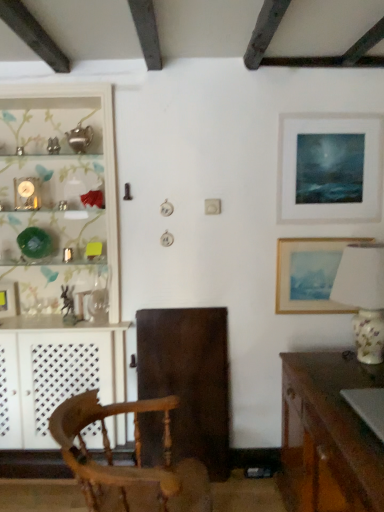
Question: Can you confirm if metallic rectangular frame at left, the first picture frame in the left-to-right sequence, is wider than wooden desk at lower right?

Choices:
 (A) yes
 (B) no

Answer: (B)

Question: Is metallic rectangular frame at left, positioned as the third picture frame in top-to-bottom order, taller than wooden desk at lower right?

Choices:
 (A) yes
 (B) no

Answer: (B)

Question: Is metallic rectangular frame at left, positioned as the third picture frame in top-to-bottom order, positioned behind wooden desk at lower right?

Choices:
 (A) yes
 (B) no

Answer: (A)

Question: Is metallic rectangular frame at left, the first picture frame in the bottom-to-top sequence, located outside wooden desk at lower right?

Choices:
 (A) no
 (B) yes

Answer: (B)

Question: Is metallic rectangular frame at left, the first picture frame in the bottom-to-top sequence, facing towards wooden desk at lower right?

Choices:
 (A) no
 (B) yes

Answer: (B)

Question: Is the depth of metallic rectangular frame at left, the first picture frame in the bottom-to-top sequence, less than that of wooden desk at lower right?

Choices:
 (A) no
 (B) yes

Answer: (A)

Question: From the image's perspective, is metallic rectangular frame at left, the first picture frame in the left-to-right sequence, above porcelain floral lamp at right?

Choices:
 (A) no
 (B) yes

Answer: (A)

Question: Does metallic rectangular frame at left, the first picture frame in the bottom-to-top sequence, have a greater width compared to porcelain floral lamp at right?

Choices:
 (A) no
 (B) yes

Answer: (A)

Question: Is metallic rectangular frame at left, positioned as the third picture frame in top-to-bottom order, outside porcelain floral lamp at right?

Choices:
 (A) no
 (B) yes

Answer: (B)

Question: Considering the relative sizes of metallic rectangular frame at left, positioned as the third picture frame in top-to-bottom order, and porcelain floral lamp at right in the image provided, is metallic rectangular frame at left, positioned as the third picture frame in top-to-bottom order, thinner than porcelain floral lamp at right?

Choices:
 (A) yes
 (B) no

Answer: (A)

Question: Is metallic rectangular frame at left, positioned as the third picture frame in top-to-bottom order, to the right of porcelain floral lamp at right from the viewer's perspective?

Choices:
 (A) no
 (B) yes

Answer: (A)

Question: Is metallic rectangular frame at left, positioned as the third picture frame in right-to-left order, bigger than porcelain floral lamp at right?

Choices:
 (A) yes
 (B) no

Answer: (B)

Question: Is matte glass shelf at left not within wooden chair at center?

Choices:
 (A) no
 (B) yes

Answer: (B)